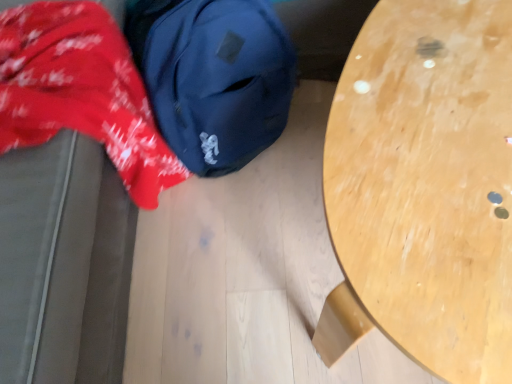
Question: Does light wood table at center have a larger size compared to red cotton fabric at left?

Choices:
 (A) no
 (B) yes

Answer: (A)

Question: From a real-world perspective, is light wood table at center located higher than red cotton fabric at left?

Choices:
 (A) yes
 (B) no

Answer: (B)

Question: Is light wood table at center at the left side of red cotton fabric at left?

Choices:
 (A) yes
 (B) no

Answer: (B)

Question: Does light wood table at center lie behind red cotton fabric at left?

Choices:
 (A) no
 (B) yes

Answer: (B)

Question: Can you confirm if light wood table at center is taller than red cotton fabric at left?

Choices:
 (A) no
 (B) yes

Answer: (A)

Question: From the image's perspective, is navy blue fabric backpack at upper left above or below light wood table at center?

Choices:
 (A) above
 (B) below

Answer: (A)

Question: Considering their positions, is navy blue fabric backpack at upper left located in front of or behind light wood table at center?

Choices:
 (A) front
 (B) behind

Answer: (B)

Question: Is navy blue fabric backpack at upper left bigger or smaller than light wood table at center?

Choices:
 (A) small
 (B) big

Answer: (A)

Question: Choose the correct answer: Is navy blue fabric backpack at upper left inside light wood table at center or outside it?

Choices:
 (A) inside
 (B) outside

Answer: (B)

Question: From their relative heights in the image, would you say light wood table at center is taller or shorter than navy blue fabric backpack at upper left?

Choices:
 (A) short
 (B) tall

Answer: (B)

Question: Is point (452, 339) positioned closer to the camera than point (202, 46)?

Choices:
 (A) closer
 (B) farther

Answer: (A)

Question: In terms of size, does light wood table at center appear bigger or smaller than navy blue fabric backpack at upper left?

Choices:
 (A) small
 (B) big

Answer: (B)

Question: Considering the positions of light wood table at center and navy blue fabric backpack at upper left in the image, is light wood table at center wider or thinner than navy blue fabric backpack at upper left?

Choices:
 (A) thin
 (B) wide

Answer: (B)

Question: Looking at their shapes, would you say light wood table at center is wider or thinner than red cotton fabric at left?

Choices:
 (A) wide
 (B) thin

Answer: (B)

Question: Considering their positions, is light wood table at center located in front of or behind red cotton fabric at left?

Choices:
 (A) behind
 (B) front

Answer: (A)